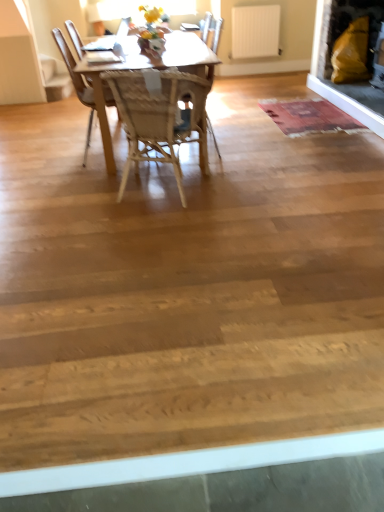
Question: Considering their positions, is white matte radiator at upper center located in front of or behind rustic woolen mat at center?

Choices:
 (A) front
 (B) behind

Answer: (B)

Question: In the image, is white matte radiator at upper center on the left side or the right side of rustic woolen mat at center?

Choices:
 (A) right
 (B) left

Answer: (B)

Question: Which is farther from the matte yellow cushion at upper right?

Choices:
 (A) white matte radiator at upper center
 (B) woven wood chair at center, which is the first chair from front to back
 (C) rustic woolen mat at center
 (D) wooden chair at center, marked as the second chair in a front-to-back arrangement

Answer: (B)

Question: Which of these objects is positioned farthest from the wooden chair at center, marked as the second chair in a front-to-back arrangement?

Choices:
 (A) rustic woolen mat at center
 (B) white matte radiator at upper center
 (C) woven wood chair at center, which is the first chair from front to back
 (D) matte yellow cushion at upper right

Answer: (C)